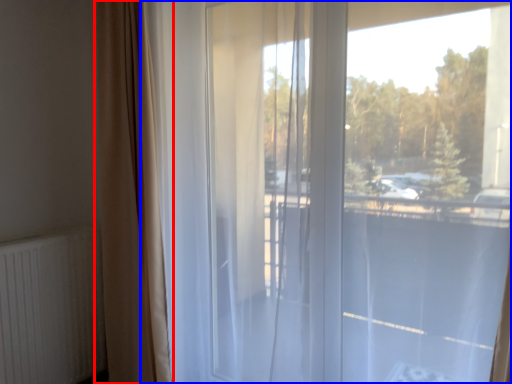
Question: Which object is further to the camera taking this photo, curtain (highlighted by a red box) or window (highlighted by a blue box)?

Choices:
 (A) curtain
 (B) window

Answer: (A)